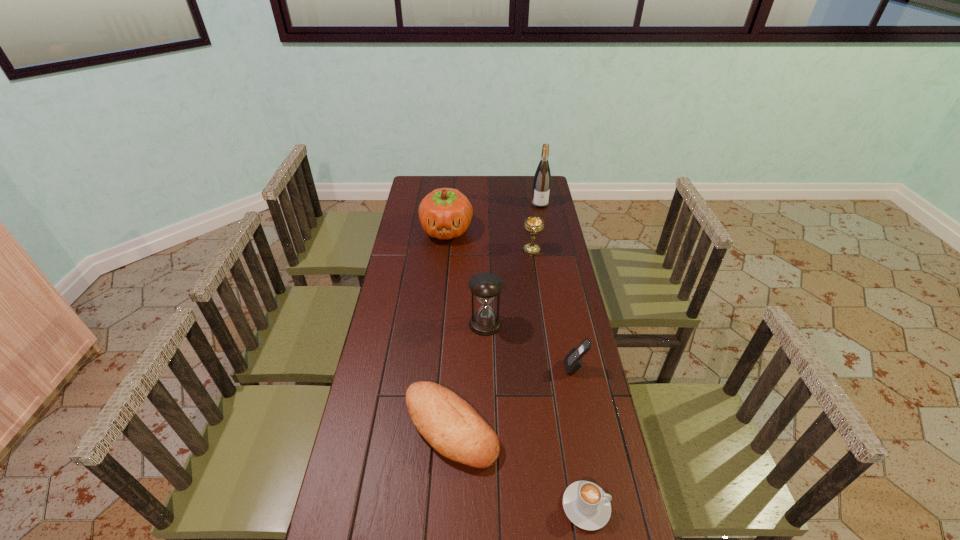
What are the coordinates of `the tallest object` in the screenshot? It's located at (542, 179).

Where is `wine bottle`? This screenshot has width=960, height=540. wine bottle is located at coordinates (542, 179).

At what (x,y) coordinates should I click in order to perform the action: click on pumpkin. Please return your answer as a coordinate pair (x, y). The height and width of the screenshot is (540, 960). Looking at the image, I should click on (x=445, y=213).

At what (x,y) coordinates should I click in order to perform the action: click on hourglass. Please return your answer as a coordinate pair (x, y). This screenshot has width=960, height=540. Looking at the image, I should click on (485, 286).

Identify the location of chalice. The width and height of the screenshot is (960, 540). (533, 224).

You are a GUI agent. You are given a task and a screenshot of the screen. Output one action in this format:
    pyautogui.click(x=<x>, y=<y>)
    Task: Click on the cellular telephone
    Image resolution: width=960 pixels, height=540 pixels.
    Given the screenshot: What is the action you would take?
    pyautogui.click(x=573, y=362)

Find the location of a particular element. This screenshot has width=960, height=540. the third shortest object is located at coordinates (573, 362).

Where is `bread`? The image size is (960, 540). bread is located at coordinates (448, 423).

You are a GUI agent. You are given a task and a screenshot of the screen. Output one action in this format:
    pyautogui.click(x=<x>, y=<y>)
    Task: Click on the sixth tallest object
    The height and width of the screenshot is (540, 960).
    Given the screenshot: What is the action you would take?
    pyautogui.click(x=448, y=423)

The width and height of the screenshot is (960, 540). Identify the location of cappuccino. (587, 506).